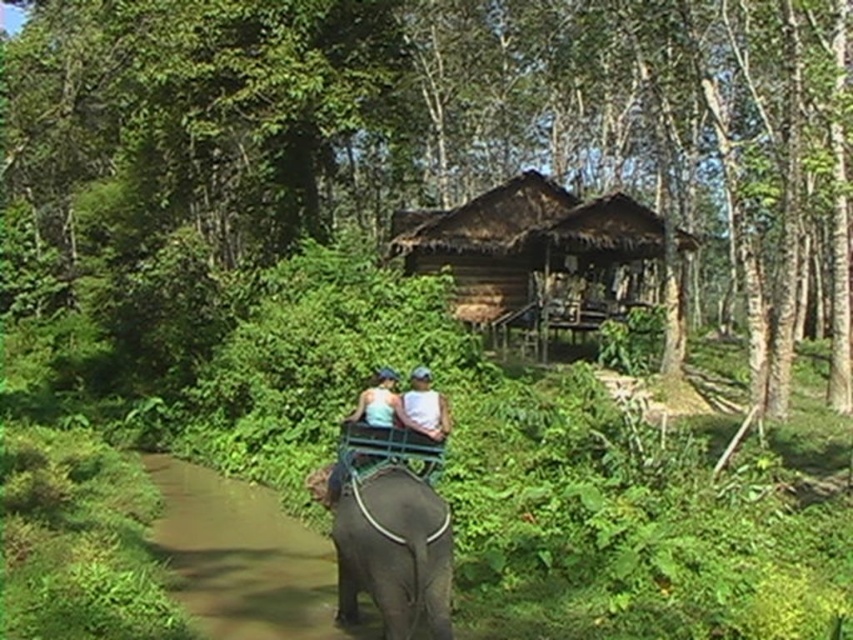
You are standing at the starting point of the forest path. You see a green leafy tree at center. If you walk straight ahead, will you reach the tree before the elephant?

The position of green leafy tree at center is at point (448, 157), so if you walk straight ahead from the starting point, you will reach the tree before the elephant since the tree is closer to the starting point than the elephant.

You are a hiker planning to take a photo of the green leafy tree at center and the brown dirt path at lower left. Which object should you focus on first if you want to capture both in a single frame without moving your camera?

The green leafy tree at center is located above the brown dirt path at lower left, so you should focus on the green leafy tree at center first to ensure both are in the frame.

Consider the image. You are standing at the point marked by the coordinates point (241, 556) in the forest scene. Looking around, you see the brown dirt path at lower left and the elephant with riders in the foreground. Which direction should you walk to reach the elephant with riders?

The point marked by point (241, 556) is located at the brown dirt path at lower left. To reach the elephant with riders in the foreground, you should walk towards the upper right direction from the brown dirt path at lower left.